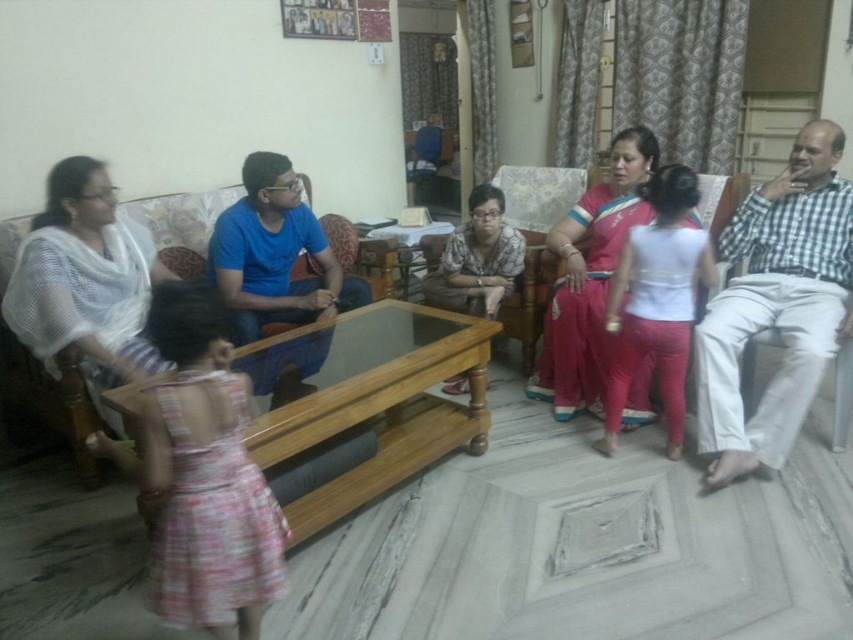
Question: Is satin pink saree at center behind matte floral dress at center?

Choices:
 (A) no
 (B) yes

Answer: (A)

Question: Can you confirm if white cotton shirt at right is positioned below white cotton blouse at center?

Choices:
 (A) no
 (B) yes

Answer: (A)

Question: Is the position of white cotton shirt at right more distant than that of matte floral dress at center?

Choices:
 (A) no
 (B) yes

Answer: (A)

Question: Which of the following is the closest to the observer?

Choices:
 (A) white cotton blouse at center
 (B) white sheer fabric at left
 (C) white cotton shirt at right
 (D) satin pink saree at center

Answer: (B)

Question: Which point is closer to the camera?

Choices:
 (A) (42, 253)
 (B) (627, 272)
 (C) (727, 253)
 (D) (567, 268)

Answer: (A)

Question: Which point is farther to the camera?

Choices:
 (A) matte floral dress at center
 (B) satin pink saree at center
 (C) white cotton shirt at right

Answer: (A)